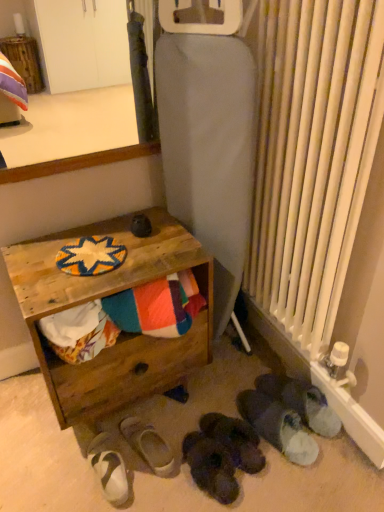
Identify the location of vacant area situated to the left side of dark gray fabric slippers at lower right, acting as the 6th footwear starting from the left. (220, 385).